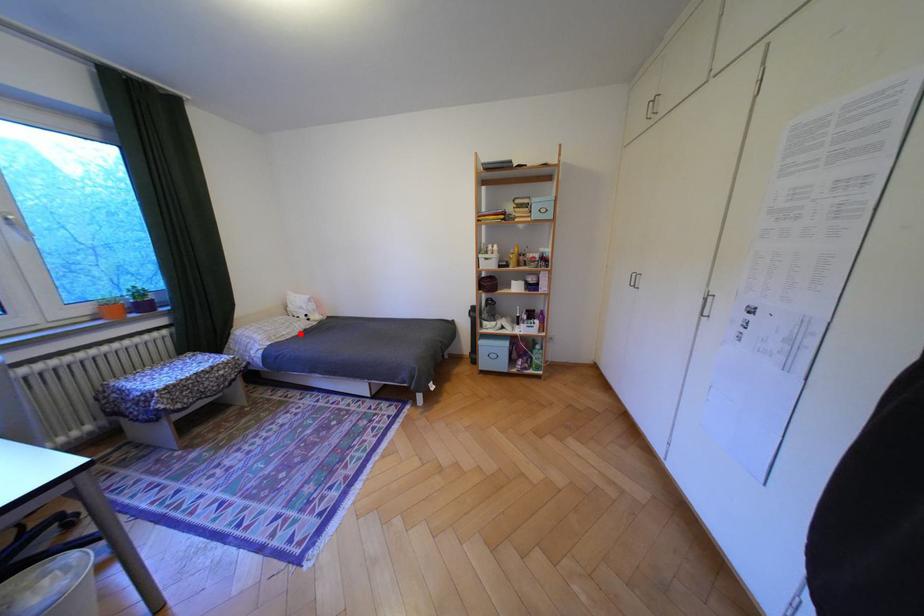
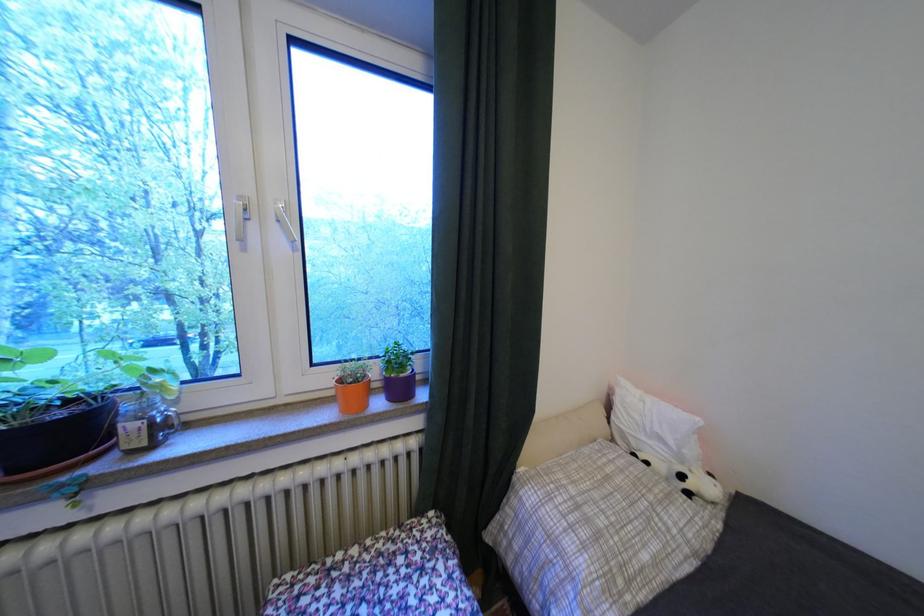
Question: I am providing you with two images of the same scene from different viewpoints. Given a red point in image1, look at the same physical point in image2. Is it:

Choices:
 (A) Closer to the viewpoint
 (B) Farther from the viewpoint

Answer: (B)